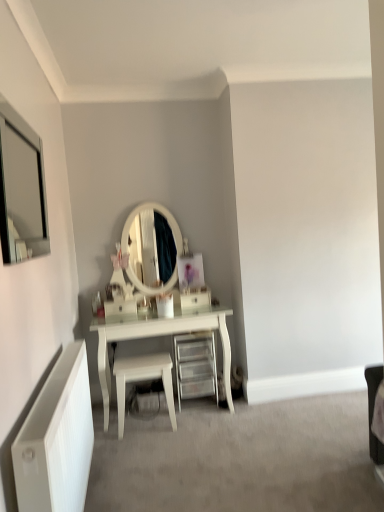
The height and width of the screenshot is (512, 384). I want to click on white glossy drawer at center, so click(195, 298).

What do you see at coordinates (195, 298) in the screenshot? I see `white glossy drawer at center` at bounding box center [195, 298].

Describe the element at coordinates (57, 439) in the screenshot. Image resolution: width=384 pixels, height=512 pixels. I see `white matte radiator at lower left` at that location.

The width and height of the screenshot is (384, 512). In order to click on matte silver mirror at upper left in this screenshot , I will do `click(21, 190)`.

Consider the image. Are white glossy drawer at center and white glossy stool at center far apart?

That's not correct — white glossy drawer at center is a little close to white glossy stool at center.

Looking at their sizes, would you say white glossy drawer at center is wider or thinner than white glossy stool at center?

Considering their sizes, white glossy drawer at center looks slimmer than white glossy stool at center.

Looking at this image, is clear plastic drawer at center facing towards white glossy drawer at center?

No.

Does point (185, 371) come farther from viewer compared to point (205, 289)?

No.

From a real-world perspective, who is located lower, clear plastic drawer at center or white glossy drawer at center?

clear plastic drawer at center.

Is white glossy stool at center behind matte silver mirror at upper left?

Yes, it is behind matte silver mirror at upper left.

Can you see white glossy stool at center touching matte silver mirror at upper left?

There is a gap between white glossy stool at center and matte silver mirror at upper left.

Is white glossy stool at center taller than matte silver mirror at upper left?

No, white glossy stool at center is not taller than matte silver mirror at upper left.

Is white glossy stool at center bigger or smaller than matte silver mirror at upper left?

Considering their sizes, white glossy stool at center takes up more space than matte silver mirror at upper left.

Who is smaller, white matte radiator at lower left or white glossy stool at center?

white glossy stool at center.

Identify the location of stool below the white matte radiator at lower left (from the image's perspective). The width and height of the screenshot is (384, 512). (143, 380).

Which is behind, point (42, 465) or point (161, 357)?

The point (161, 357) is farther.

From the image's perspective, which one is positioned higher, white matte radiator at lower left or white glossy stool at center?

From the image's view, white matte radiator at lower left is above.

Can you confirm if clear plastic drawer at center is smaller than white matte radiator at lower left?

Yes, clear plastic drawer at center is smaller than white matte radiator at lower left.

From a real-world perspective, between clear plastic drawer at center and white matte radiator at lower left, who is vertically higher?

white matte radiator at lower left.

Is clear plastic drawer at center placed right next to white matte radiator at lower left?

They are not placed beside each other.

Does clear plastic drawer at center contain matte silver mirror at upper left?

No, matte silver mirror at upper left is located outside of clear plastic drawer at center.

Considering the relative sizes of clear plastic drawer at center and matte silver mirror at upper left in the image provided, is clear plastic drawer at center smaller than matte silver mirror at upper left?

Incorrect, clear plastic drawer at center is not smaller in size than matte silver mirror at upper left.

Considering the relative positions of clear plastic drawer at center and matte silver mirror at upper left in the image provided, is clear plastic drawer at center behind matte silver mirror at upper left?

Yes, clear plastic drawer at center is further from the viewer.

Consider the image. Considering the sizes of white glossy stool at center and clear plastic drawer at center in the image, is white glossy stool at center bigger or smaller than clear plastic drawer at center?

Clearly, white glossy stool at center is smaller in size than clear plastic drawer at center.

From a real-world perspective, is white glossy stool at center above or below clear plastic drawer at center?

white glossy stool at center is situated lower than clear plastic drawer at center in the real world.

At what (x,y) coordinates should I click in order to perform the action: click on stool below the clear plastic drawer at center (from the image's perspective). Please return your answer as a coordinate pair (x, y). This screenshot has width=384, height=512. Looking at the image, I should click on (143, 380).

Can you confirm if white glossy stool at center is thinner than clear plastic drawer at center?

Correct, the width of white glossy stool at center is less than that of clear plastic drawer at center.

Locate an element on the screen. The image size is (384, 512). drawer behind the white glossy stool at center is located at coordinates (195, 298).

The image size is (384, 512). In order to click on drawer above the clear plastic drawer at center (from a real-world perspective) in this screenshot , I will do `click(195, 298)`.

Which object lies further to the anchor point matte silver mirror at upper left, white glossy stool at center or clear plastic drawer at center?

The object further to matte silver mirror at upper left is clear plastic drawer at center.

Looking at the image, which one is located closer to matte silver mirror at upper left, white glossy drawer at center or clear plastic drawer at center?

white glossy drawer at center lies closer to matte silver mirror at upper left than the other object.

Estimate the real-world distances between objects in this image. Which object is further from white glossy stool at center, matte silver mirror at upper left or clear plastic drawer at center?

matte silver mirror at upper left lies further to white glossy stool at center than the other object.

Estimate the real-world distances between objects in this image. Which object is further from matte silver mirror at upper left, clear plastic drawer at center or white glossy stool at center?

Among the two, clear plastic drawer at center is located further to matte silver mirror at upper left.

Which object lies nearer to the anchor point white matte radiator at lower left, clear plastic drawer at center or white glossy stool at center?

white glossy stool at center lies closer to white matte radiator at lower left than the other object.

Which object lies further to the anchor point white matte radiator at lower left, matte silver mirror at upper left or white glossy drawer at center?

Based on the image, matte silver mirror at upper left appears to be further to white matte radiator at lower left.

Based on their spatial positions, is clear plastic drawer at center or white matte radiator at lower left further from matte silver mirror at upper left?

Based on the image, white matte radiator at lower left appears to be further to matte silver mirror at upper left.

Looking at the image, which one is located closer to clear plastic drawer at center, matte silver mirror at upper left or white glossy drawer at center?

white glossy drawer at center.

Locate an element on the screen. The height and width of the screenshot is (512, 384). shelf between white glossy drawer at center and white glossy stool at center in the vertical direction is located at coordinates [195, 366].

Find the location of a particular element. The width and height of the screenshot is (384, 512). mirror between white matte radiator at lower left and white glossy drawer at center along the z-axis is located at coordinates (21, 190).

At what (x,y) coordinates should I click in order to perform the action: click on stool located between white matte radiator at lower left and white glossy drawer at center in the depth direction. Please return your answer as a coordinate pair (x, y). The height and width of the screenshot is (512, 384). Looking at the image, I should click on coord(143,380).

Find the location of a particular element. The width and height of the screenshot is (384, 512). stool between matte silver mirror at upper left and white glossy drawer at center in the front-back direction is located at coordinates (143, 380).